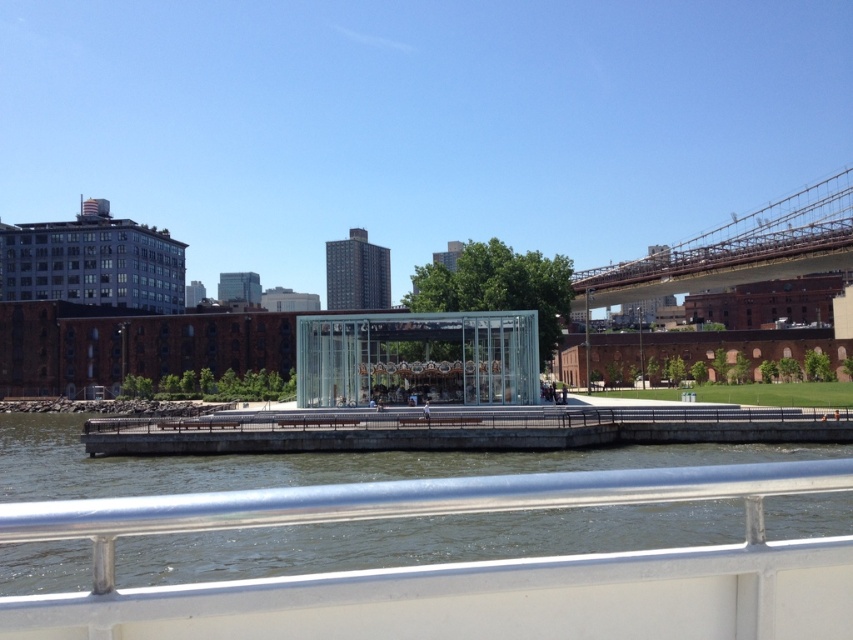
From the picture: Who is shorter, transparent glass carousel at center or brown wooden bridge at upper right?

With less height is transparent glass carousel at center.

Which is above, transparent glass carousel at center or brown wooden bridge at upper right?

brown wooden bridge at upper right is higher up.

This screenshot has height=640, width=853. I want to click on transparent glass carousel at center, so click(x=416, y=358).

I want to click on transparent glass carousel at center, so click(416, 358).

Who is taller, greenish water at lower center or transparent glass carousel at center?

With more height is greenish water at lower center.

Who is more distant from viewer, (572, 451) or (485, 328)?

The point (485, 328) is more distant.

The image size is (853, 640). What are the coordinates of `greenish water at lower center` in the screenshot? It's located at (422, 540).

Does greenish water at lower center lie behind brown wooden bridge at upper right?

No, greenish water at lower center is in front of brown wooden bridge at upper right.

Is greenish water at lower center closer to camera compared to brown wooden bridge at upper right?

Yes, it is in front of brown wooden bridge at upper right.

Locate an element on the screen. The image size is (853, 640). greenish water at lower center is located at coordinates (422, 540).